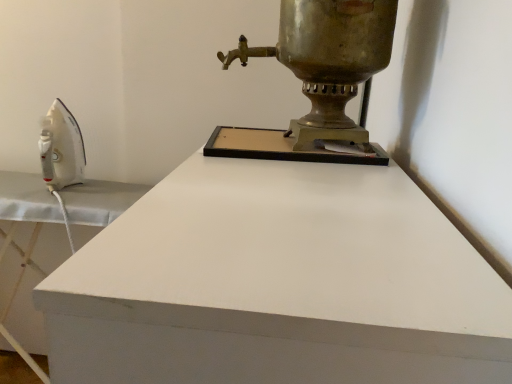
This screenshot has height=384, width=512. Describe the element at coordinates (278, 284) in the screenshot. I see `white glossy ironing board at left` at that location.

You are a GUI agent. You are given a task and a screenshot of the screen. Output one action in this format:
    pyautogui.click(x=<x>, y=<y>)
    Task: Click on the white glossy ironing board at left
    This screenshot has height=384, width=512.
    Given the screenshot: What is the action you would take?
    [278, 284]

What is the approximate height of shiny brass samovar at upper right?

shiny brass samovar at upper right is 11.74 inches tall.

Describe the element at coordinates (320, 75) in the screenshot. This screenshot has height=384, width=512. I see `shiny brass samovar at upper right` at that location.

Image resolution: width=512 pixels, height=384 pixels. In order to click on shiny brass samovar at upper right in this screenshot , I will do `click(320, 75)`.

Where is `white glossy ironing board at left`? white glossy ironing board at left is located at coordinates (278, 284).

Is shiny brass samovar at upper right to the left or to the right of white glossy ironing board at left in the image?

From the image, it's evident that shiny brass samovar at upper right is to the right of white glossy ironing board at left.

Which object is closer to the camera taking this photo, shiny brass samovar at upper right or white glossy ironing board at left?

Positioned in front is white glossy ironing board at left.

Which is behind, point (233, 51) or point (300, 201)?

The point (233, 51) is more distant.

From the image's perspective, which is below, shiny brass samovar at upper right or white glossy ironing board at left?

From the image's view, white glossy ironing board at left is below.

From a real-world perspective, is shiny brass samovar at upper right over white glossy ironing board at left?

Correct, in the physical world, shiny brass samovar at upper right is higher than white glossy ironing board at left.

Is shiny brass samovar at upper right thinner than white glossy ironing board at left?

Yes, shiny brass samovar at upper right is thinner than white glossy ironing board at left.

Is shiny brass samovar at upper right taller or shorter than white glossy ironing board at left?

Considering their sizes, shiny brass samovar at upper right has less height than white glossy ironing board at left.

Can you confirm if shiny brass samovar at upper right is bigger than white glossy ironing board at left?

No.

Can white glossy ironing board at left be found inside shiny brass samovar at upper right?

No, white glossy ironing board at left is located outside of shiny brass samovar at upper right.

Is shiny brass samovar at upper right beside white glossy ironing board at left?

No, shiny brass samovar at upper right is not beside white glossy ironing board at left.

Is shiny brass samovar at upper right turned away from white glossy ironing board at left?

No, shiny brass samovar at upper right's orientation is not away from white glossy ironing board at left.

How many degrees apart are the facing directions of shiny brass samovar at upper right and white glossy ironing board at left?

6.92 degrees.

Measure the distance between shiny brass samovar at upper right and white glossy ironing board at left.

They are 34.86 centimeters apart.

I want to click on sewing machine that is on the right side of white glossy ironing board at left, so click(320, 75).

Which object is positioned more to the right, white glossy ironing board at left or shiny brass samovar at upper right?

Positioned to the right is shiny brass samovar at upper right.

Consider the image. Which object is further away from the camera, white glossy ironing board at left or shiny brass samovar at upper right?

Positioned behind is shiny brass samovar at upper right.

Which is closer, [353,200] or [368,20]?

The point [353,200] is more forward.

In the scene shown: From the image's perspective, which one is positioned higher, white glossy ironing board at left or shiny brass samovar at upper right?

shiny brass samovar at upper right.

From a real-world perspective, is white glossy ironing board at left above or below shiny brass samovar at upper right?

From a real-world perspective, white glossy ironing board at left is physically below shiny brass samovar at upper right.

Is white glossy ironing board at left wider or thinner than shiny brass samovar at upper right?

white glossy ironing board at left is wider than shiny brass samovar at upper right.

Is white glossy ironing board at left taller or shorter than shiny brass samovar at upper right?

Considering their sizes, white glossy ironing board at left has more height than shiny brass samovar at upper right.

Does white glossy ironing board at left have a larger size compared to shiny brass samovar at upper right?

Indeed, white glossy ironing board at left has a larger size compared to shiny brass samovar at upper right.

Is shiny brass samovar at upper right inside white glossy ironing board at left?

No, white glossy ironing board at left does not contain shiny brass samovar at upper right.

Is there a large distance between white glossy ironing board at left and shiny brass samovar at upper right?

No.

Is shiny brass samovar at upper right at the back of white glossy ironing board at left?

That's not correct — white glossy ironing board at left is not looking away from shiny brass samovar at upper right.

What's the angular difference between white glossy ironing board at left and shiny brass samovar at upper right's facing directions?

They differ by 6.92 degrees in their facing directions.

Identify the location of desk directly beneath the shiny brass samovar at upper right (from a real-world perspective). (278, 284).

Find the location of a particular element. The width and height of the screenshot is (512, 384). sewing machine positioned vertically above the white glossy ironing board at left (from a real-world perspective) is located at coordinates (320, 75).

You are a GUI agent. You are given a task and a screenshot of the screen. Output one action in this format:
    pyautogui.click(x=<x>, y=<y>)
    Task: Click on the sewing machine behind the white glossy ironing board at left
    Image resolution: width=512 pixels, height=384 pixels.
    Given the screenshot: What is the action you would take?
    pyautogui.click(x=320, y=75)